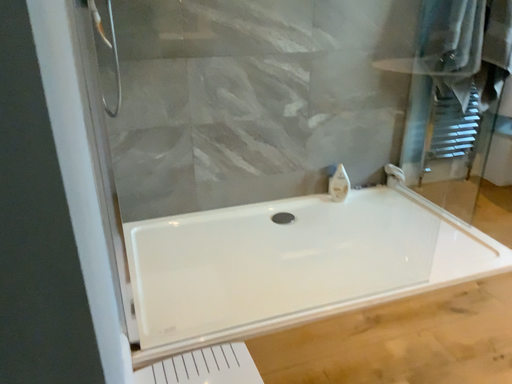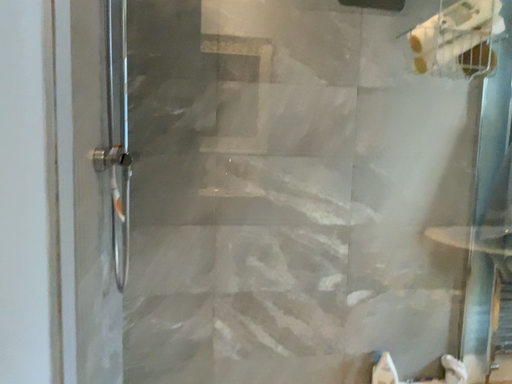
Question: Which way did the camera rotate in the video?

Choices:
 (A) rotated left
 (B) rotated right

Answer: (A)